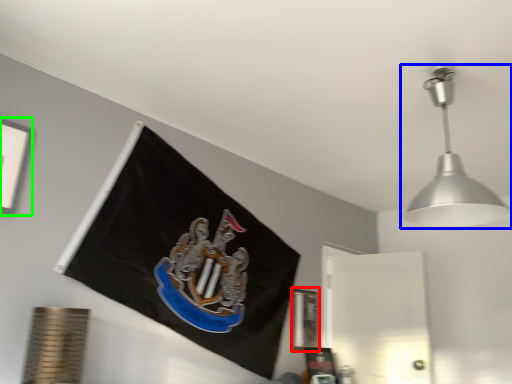
Question: Based on their relative distances, which object is farther from picture frame (highlighted by a red box)? Choose from lamp (highlighted by a blue box) and picture frame (highlighted by a green box).

Choices:
 (A) lamp
 (B) picture frame

Answer: (B)